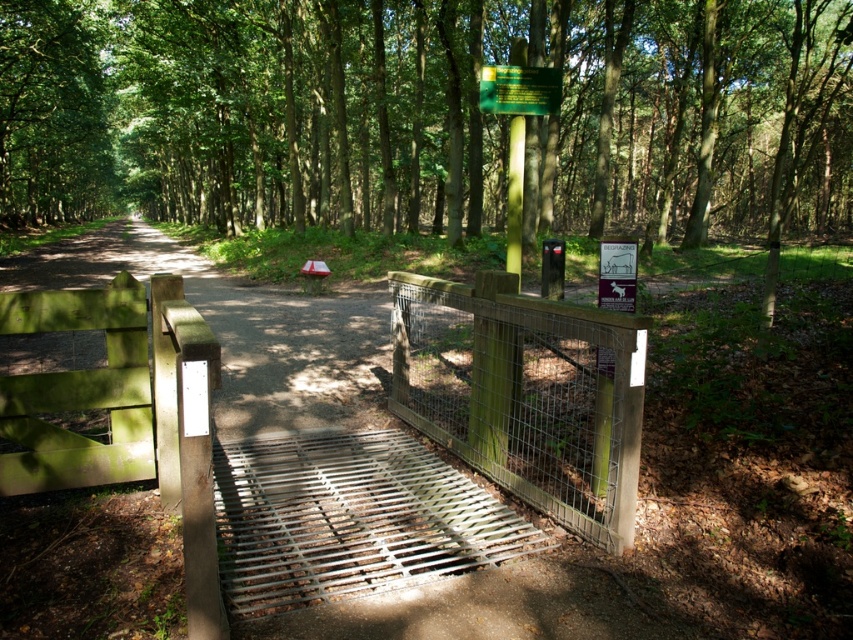
You are a hiker carrying a 1.5 meter wide backpack. You need to pass through the wooden wire mesh gate at center. Can you also pass by the green matte pole at center without touching it?

The wooden wire mesh gate at center might be wider than green matte pole at center, so there is a possibility that the gate is wide enough for your backpack. However, the green matte pole at center is narrower, so you should ensure enough space between them to pass safely.

You are standing at the entrance of the forest and see the wooden wire mesh gate at center. If you walk straight ahead, will you eventually reach the dirt path that stretches into the distance?

Yes, because the dirt path is directly in front of the wooden wire mesh gate at center, so walking straight ahead will lead you along the path.

You are a hiker approaching the wooden gate and notice the green matte sign at upper center and the green matte pole at center. Which object would block your view of the other if you were standing directly in front of the gate?

The green matte pole at center is behind the green matte pole at center, so the green matte sign at upper center would block your view of the green matte pole at center if you were standing directly in front of the gate.